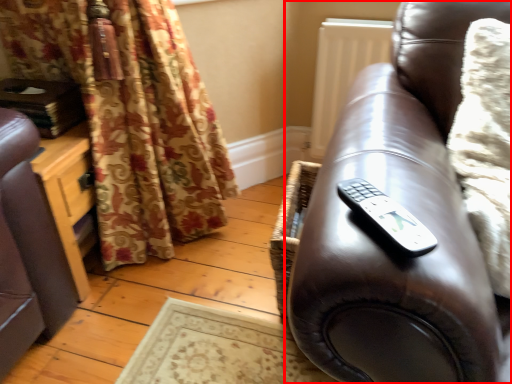
Question: From the image's perspective, considering the relative positions of studio couch (annotated by the red box) and remote in the image provided, where is studio couch (annotated by the red box) located with respect to the staircase?

Choices:
 (A) below
 (B) above

Answer: (A)